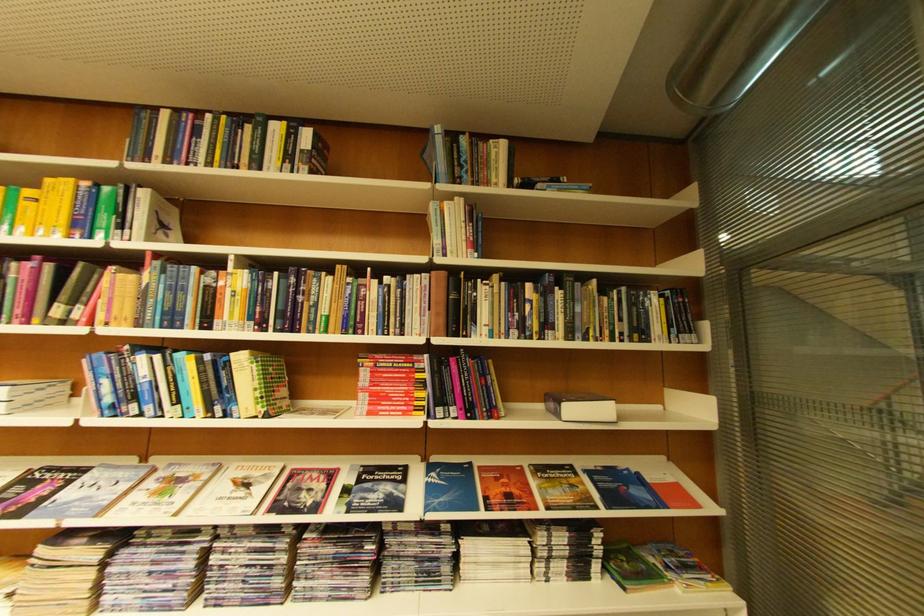
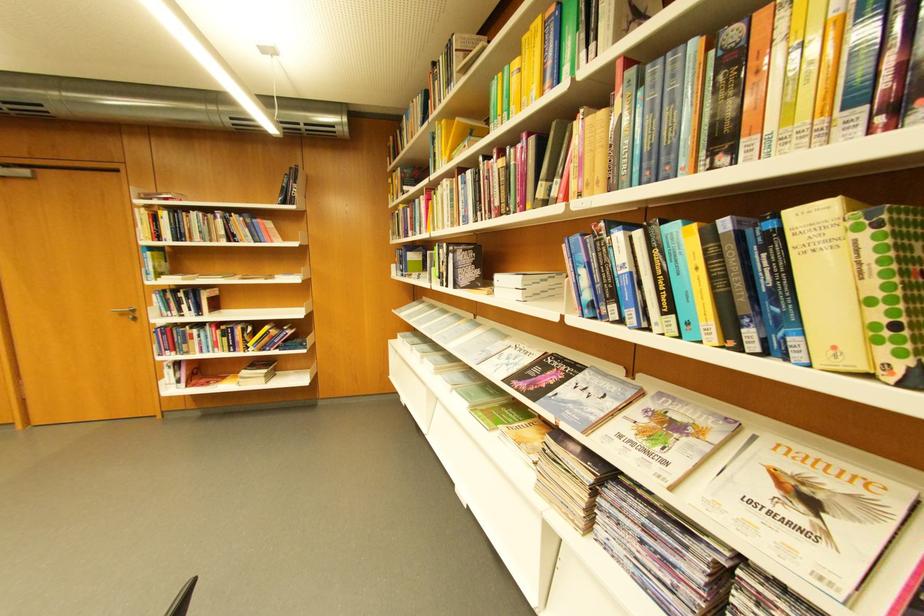
Where in the second image is the point corresponding to point 262,357 from the first image?

(861, 209)